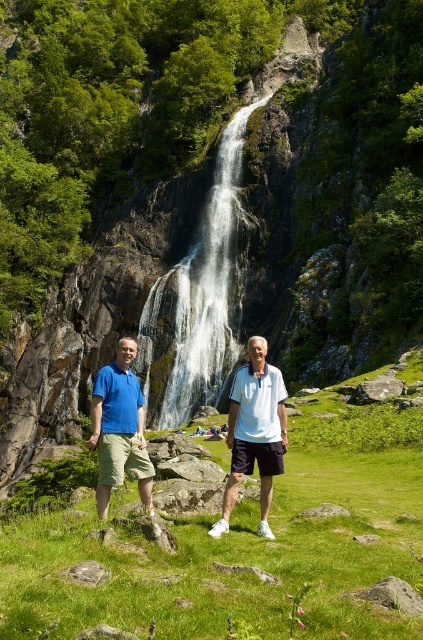
From the picture: You are a photographer trying to capture a photo of both the blue cotton shirt at center and the matte blue shirt at center. Since you want them to be side by side, which one should you place on the right side of the frame to match their current positions?

The blue cotton shirt at center is already positioned on the right side of the matte blue shirt at center, so to match their current positions, you should place the blue cotton shirt at center on the right side of the frame.

You are planning to take a photo of the two people wearing the blue cotton shirt at center and the white matte shirt at center. Which person should you focus on first if you want to capture someone closer to the camera?

The blue cotton shirt at center is shorter than the white matte shirt at center, so the person wearing the blue cotton shirt at center is closer to the camera and should be focused on first.